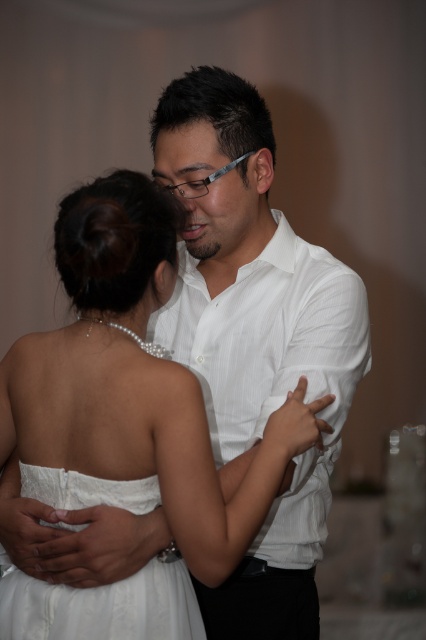
You are a photographer standing 1.2 meters away from the camera. You need to adjust your position so that you can clearly see the white satin dress at center in the camera viewfinder. Should you move closer to or farther away from the camera?

The white satin dress at center and camera are 1.05 meters apart from each other. Since you are already 1.2 meters away from the camera, moving closer would reduce the distance between you and the camera, potentially blocking the view. To ensure the white satin dress at center is visible in the camera viewfinder, you should move farther away from the camera to maintain a clear line of sight.

Based on the photo, you are a photographer standing 10 feet away from the two people in the image. You need to capture a closeup shot of both the white satin dress at center and the white smooth shirt at center in a single frame. Given that your camera has a maximum focus range of 8 inches, will you be able to achieve this?

The distance between the white satin dress at center and the white smooth shirt at center is 7.75 inches, which is within the camera maximum focus range of 8 inches. Therefore, you can capture both in a single frame.